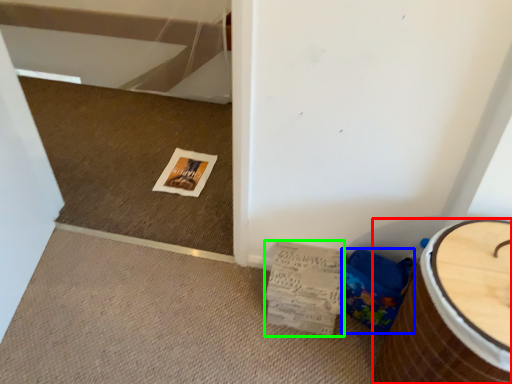
Question: Considering the real-world distances, which object is closest to furniture (highlighted by a red box)? potty (highlighted by a blue box) or magazine (highlighted by a green box).

Choices:
 (A) potty
 (B) magazine

Answer: (A)